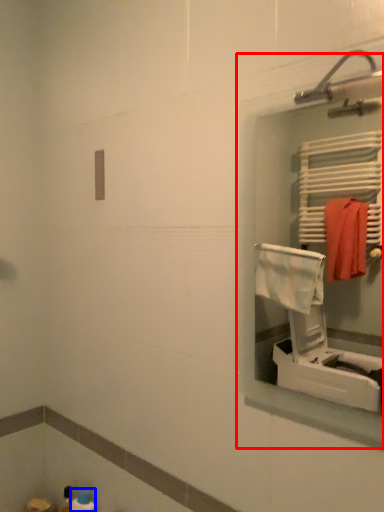
Question: Among these objects, which one is farthest to the camera, medicine cabinet (highlighted by a red box) or toiletry (highlighted by a blue box)?

Choices:
 (A) medicine cabinet
 (B) toiletry

Answer: (B)